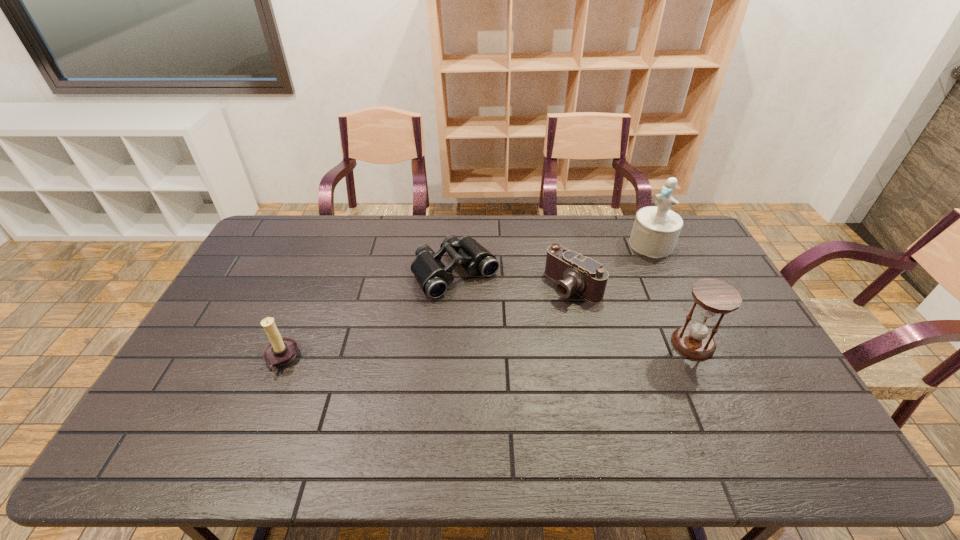
Identify the location of vacant space located on the front-facing side of the third object from left to right. (541, 313).

What are the coordinates of `vacant area located on the front-facing side of the third object from left to right` in the screenshot? It's located at (x=541, y=313).

Locate an element on the screen. The height and width of the screenshot is (540, 960). vacant area located on the front-facing side of the third object from left to right is located at coordinates (492, 352).

This screenshot has height=540, width=960. What are the coordinates of `free location located at the beak of the figurine` in the screenshot? It's located at (596, 289).

Find the location of a particular element. The width and height of the screenshot is (960, 540). vacant area situated 0.210m at the beak of the figurine is located at coordinates (607, 281).

You are a GUI agent. You are given a task and a screenshot of the screen. Output one action in this format:
    pyautogui.click(x=<x>, y=<y>)
    Task: Click on the vacant space located 0.070m at the beak of the figurine
    
    Given the screenshot: What is the action you would take?
    pyautogui.click(x=629, y=262)

Where is `vacant space situated 0.050m on the front-facing side of the second object from left to right`? The image size is (960, 540). vacant space situated 0.050m on the front-facing side of the second object from left to right is located at coordinates (487, 307).

This screenshot has width=960, height=540. In order to click on vacant point located 0.230m on the front-facing side of the second object from left to right in this screenshot , I will do `click(519, 345)`.

Where is `free space located on the front-facing side of the second object from left to right`? free space located on the front-facing side of the second object from left to right is located at coordinates (540, 369).

The image size is (960, 540). What are the coordinates of `figurine that is at the far edge` in the screenshot? It's located at (656, 229).